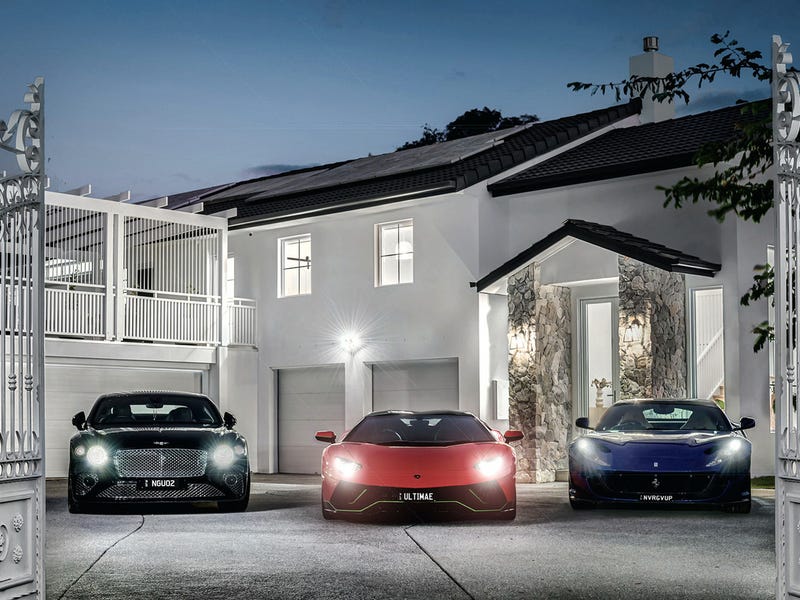
You are a GUI agent. You are given a task and a screenshot of the screen. Output one action in this format:
    pyautogui.click(x=<x>, y=<y>)
    Task: Click on the entrance
    The image size is (800, 600).
    Given the screenshot: What is the action you would take?
    pyautogui.click(x=589, y=263)